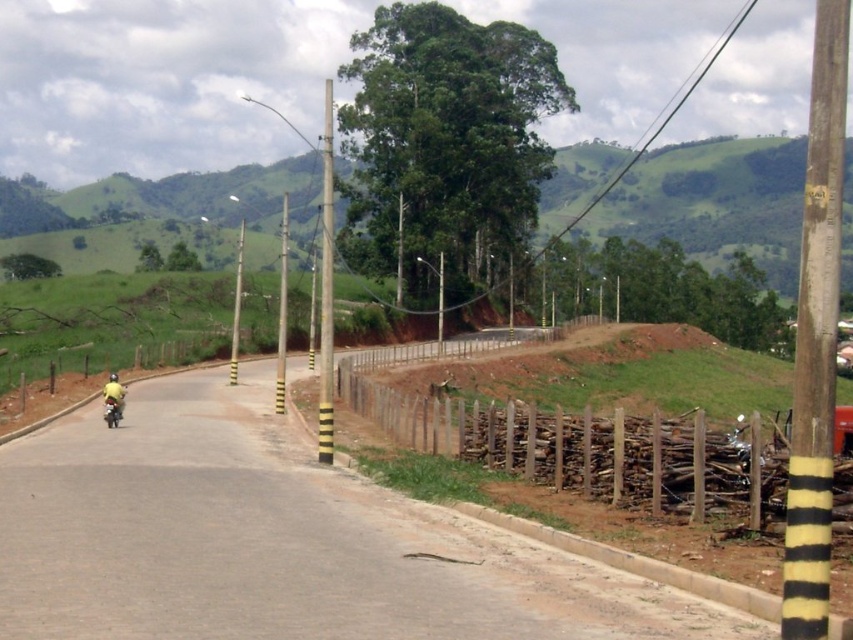
Measure the distance from brown dirt track at lower right to green grassy hill at upper center.

→ A distance of 101.73 meters exists between brown dirt track at lower right and green grassy hill at upper center.

Identify the location of brown dirt track at lower right. The image size is (853, 640). (277, 541).

Does point (262, 204) come in front of point (111, 394)?

That is False.

Measure the distance between green grassy hill at upper center and camera.

green grassy hill at upper center and camera are 7.45 meters apart from each other.

The height and width of the screenshot is (640, 853). Identify the location of green grassy hill at upper center. (712, 202).

Which is more to the left, brown dirt track at lower right or yellow fabric person at left?

yellow fabric person at left is more to the left.

Is brown dirt track at lower right to the right of yellow fabric person at left from the viewer's perspective?

Yes, brown dirt track at lower right is to the right of yellow fabric person at left.

Is point (57, 525) in front of point (114, 380)?

Yes, point (57, 525) is closer to viewer.

Where is `brown dirt track at lower right`? The image size is (853, 640). brown dirt track at lower right is located at coordinates (277, 541).